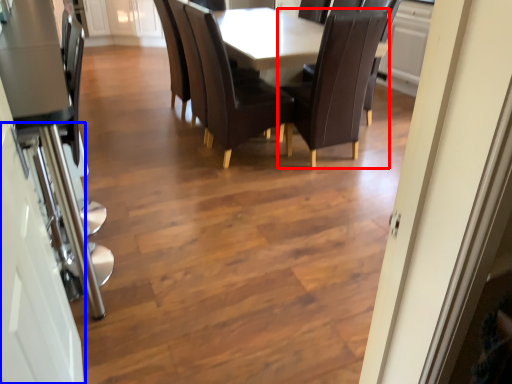
Question: Which object is closer to the camera taking this photo, chair (highlighted by a red box) or glass door (highlighted by a blue box)?

Choices:
 (A) chair
 (B) glass door

Answer: (B)